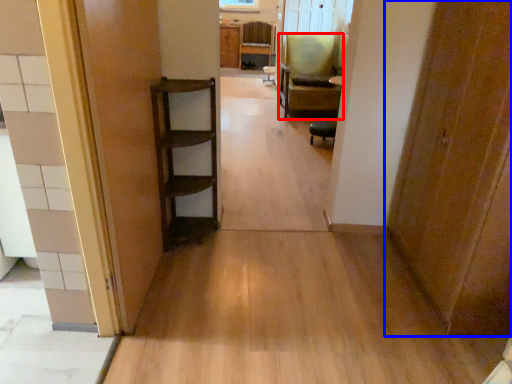
Question: Which object appears closest to the camera in this image, chair (highlighted by a red box) or door (highlighted by a blue box)?

Choices:
 (A) chair
 (B) door

Answer: (B)